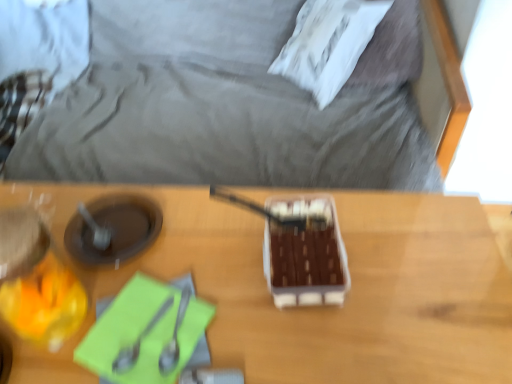
Where is `free space above wooden table at center (from a real-world perspective)`? This screenshot has height=384, width=512. free space above wooden table at center (from a real-world perspective) is located at coordinates (213, 262).